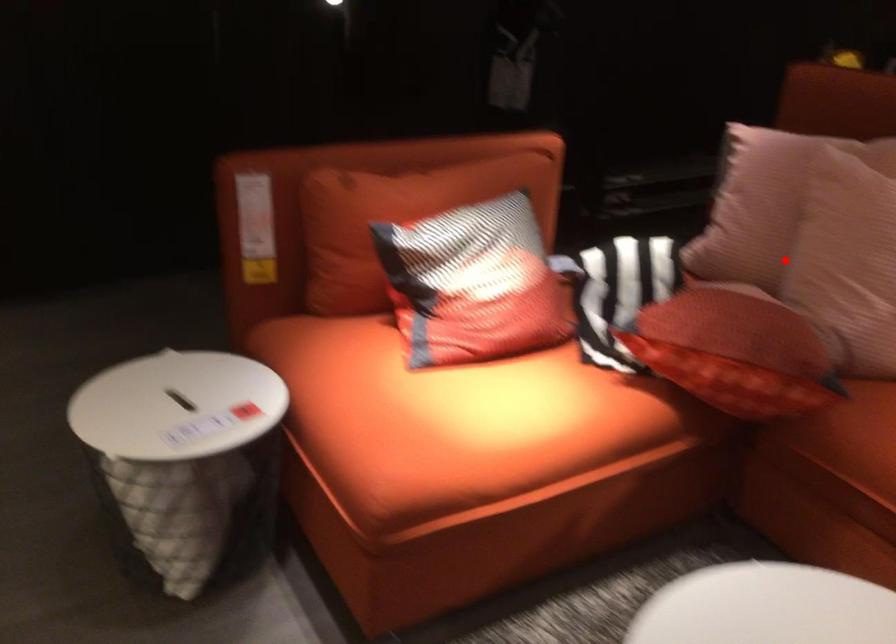
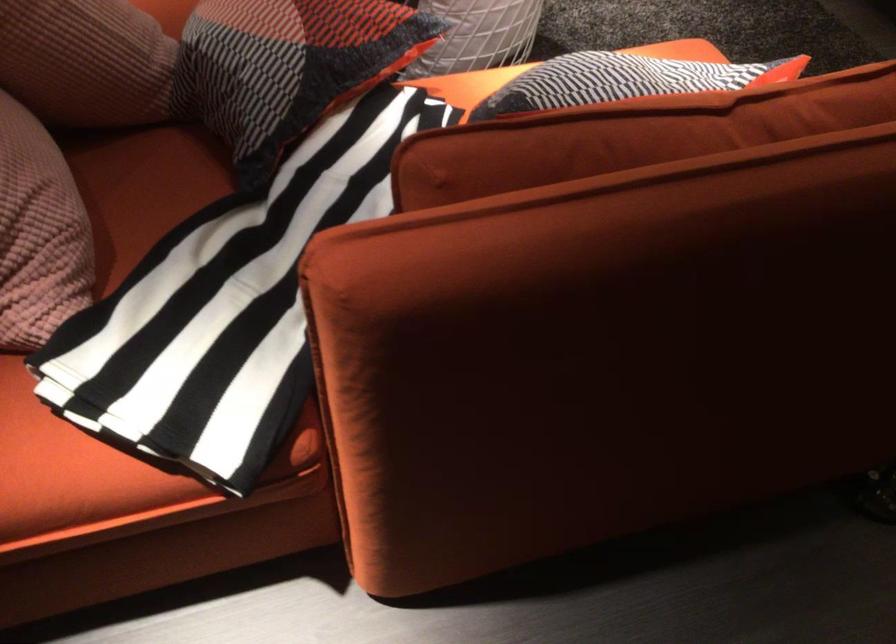
The point at the highlighted location is marked in the first image. Where is the corresponding point in the second image?

(85, 61)